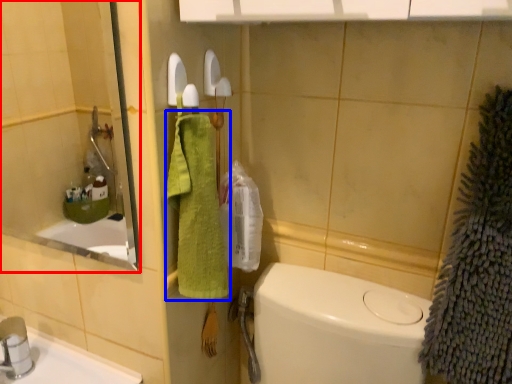
Question: Among these objects, which one is nearest to the camera, mirror (highlighted by a red box) or bath towel (highlighted by a blue box)?

Choices:
 (A) mirror
 (B) bath towel

Answer: (A)